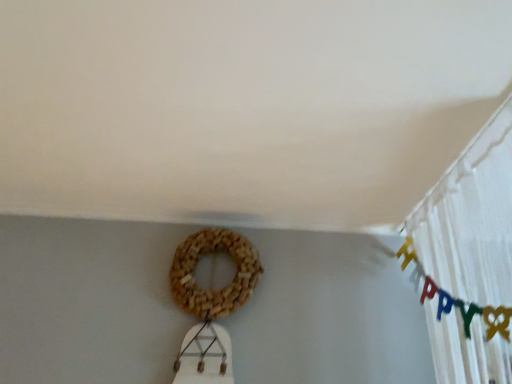
Question: Looking at the image, does brown woven wreath at center seem bigger or smaller compared to white sheer curtain at upper right?

Choices:
 (A) big
 (B) small

Answer: (B)

Question: Is point (224, 309) positioned closer to the camera than point (509, 110)?

Choices:
 (A) farther
 (B) closer

Answer: (A)

Question: From a real-world perspective, is brown woven wreath at center positioned above or below white sheer curtain at upper right?

Choices:
 (A) above
 (B) below

Answer: (A)

Question: In the image, is white sheer curtain at upper right positioned in front of or behind brown woven wreath at center?

Choices:
 (A) behind
 (B) front

Answer: (B)

Question: Considering the positions of white sheer curtain at upper right and brown woven wreath at center in the image, is white sheer curtain at upper right wider or thinner than brown woven wreath at center?

Choices:
 (A) wide
 (B) thin

Answer: (A)

Question: Which is correct: white sheer curtain at upper right is inside brown woven wreath at center, or outside of it?

Choices:
 (A) inside
 (B) outside

Answer: (B)

Question: Is point (440, 375) positioned closer to the camera than point (211, 317)?

Choices:
 (A) farther
 (B) closer

Answer: (B)